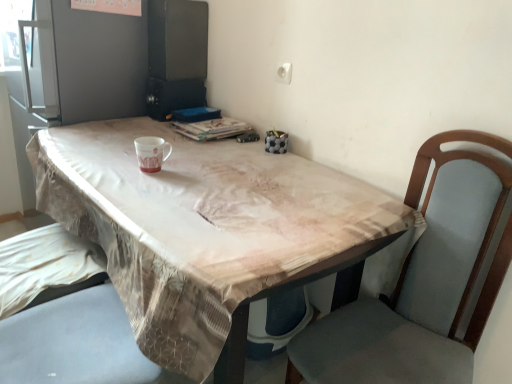
Locate an element on the screen. This screenshot has height=384, width=512. brown fabric table at center is located at coordinates (200, 226).

This screenshot has width=512, height=384. Describe the element at coordinates (200, 226) in the screenshot. I see `brown fabric table at center` at that location.

Locate an element on the screen. matte ceramic mug at center is located at coordinates (151, 153).

Describe the element at coordinates (151, 153) in the screenshot. This screenshot has width=512, height=384. I see `matte ceramic mug at center` at that location.

Find the location of a particular element. Image resolution: width=512 pixels, height=384 pixels. brown fabric table at center is located at coordinates (200, 226).

Considering the positions of objects matte ceramic mug at center and brown fabric table at center in the image provided, who is more to the right, matte ceramic mug at center or brown fabric table at center?

Positioned to the right is brown fabric table at center.

Is matte ceramic mug at center positioned in front of brown fabric table at center?

No, matte ceramic mug at center is further to the viewer.

Is point (150, 151) closer or farther from the camera than point (266, 153)?

Point (150, 151) is closer to the camera than point (266, 153).

From the image's perspective, is matte ceramic mug at center over brown fabric table at center?

Indeed, from the image's perspective, matte ceramic mug at center is shown above brown fabric table at center.

From a real-world perspective, is matte ceramic mug at center on top of brown fabric table at center?

Yes, from a real-world perspective, matte ceramic mug at center is over brown fabric table at center

Between matte ceramic mug at center and brown fabric table at center, which one has smaller width?

With smaller width is matte ceramic mug at center.

Which of these two, matte ceramic mug at center or brown fabric table at center, stands taller?

brown fabric table at center is taller.

Looking at the image, does matte ceramic mug at center seem bigger or smaller compared to brown fabric table at center?

In the image, matte ceramic mug at center appears to be smaller than brown fabric table at center.

Is matte ceramic mug at center located outside brown fabric table at center?

Indeed, matte ceramic mug at center is completely outside brown fabric table at center.

Does matte ceramic mug at center touch brown fabric table at center?

There is a gap between matte ceramic mug at center and brown fabric table at center.

Could you tell me if matte ceramic mug at center is turned towards brown fabric table at center?

No, matte ceramic mug at center does not turn towards brown fabric table at center.

At what (x,y) coordinates should I click in order to perform the action: click on mug on the left side of brown fabric table at center. Please return your answer as a coordinate pair (x, y). Image resolution: width=512 pixels, height=384 pixels. Looking at the image, I should click on click(x=151, y=153).

Can you confirm if brown fabric table at center is positioned to the left of matte ceramic mug at center?

In fact, brown fabric table at center is to the right of matte ceramic mug at center.

Is the depth of brown fabric table at center less than that of matte ceramic mug at center?

Yes, the depth of brown fabric table at center is less than that of matte ceramic mug at center.

Is point (202, 205) positioned after point (158, 153)?

No, it is not.

From the image's perspective, is brown fabric table at center above matte ceramic mug at center?

Incorrect, from the image's perspective, brown fabric table at center is lower than matte ceramic mug at center.

From a real-world perspective, does brown fabric table at center stand above matte ceramic mug at center?

Incorrect, from a real-world perspective, brown fabric table at center is lower than matte ceramic mug at center.

Is brown fabric table at center wider or thinner than matte ceramic mug at center?

Clearly, brown fabric table at center has more width compared to matte ceramic mug at center.

Is brown fabric table at center taller than matte ceramic mug at center?

Yes.

In the scene shown: Which of these two, brown fabric table at center or matte ceramic mug at center, is bigger?

brown fabric table at center.

Would you say brown fabric table at center is inside or outside matte ceramic mug at center?

brown fabric table at center cannot be found inside matte ceramic mug at center.

In the scene shown: Is brown fabric table at center far away from matte ceramic mug at center?

No, brown fabric table at center is not far from matte ceramic mug at center.

Is brown fabric table at center facing towards matte ceramic mug at center?

No, brown fabric table at center is not turned towards matte ceramic mug at center.

What's the angular difference between brown fabric table at center and matte ceramic mug at center's facing directions?

They differ by 6.08 degrees in their facing directions.

This screenshot has height=384, width=512. What are the coordinates of `mug that is behind the brown fabric table at center` in the screenshot? It's located at (151, 153).

The image size is (512, 384). Find the location of `mug above the brown fabric table at center (from a real-world perspective)`. mug above the brown fabric table at center (from a real-world perspective) is located at coordinates [x=151, y=153].

Identify the location of mug on the left side of brown fabric table at center. This screenshot has width=512, height=384. (151, 153).